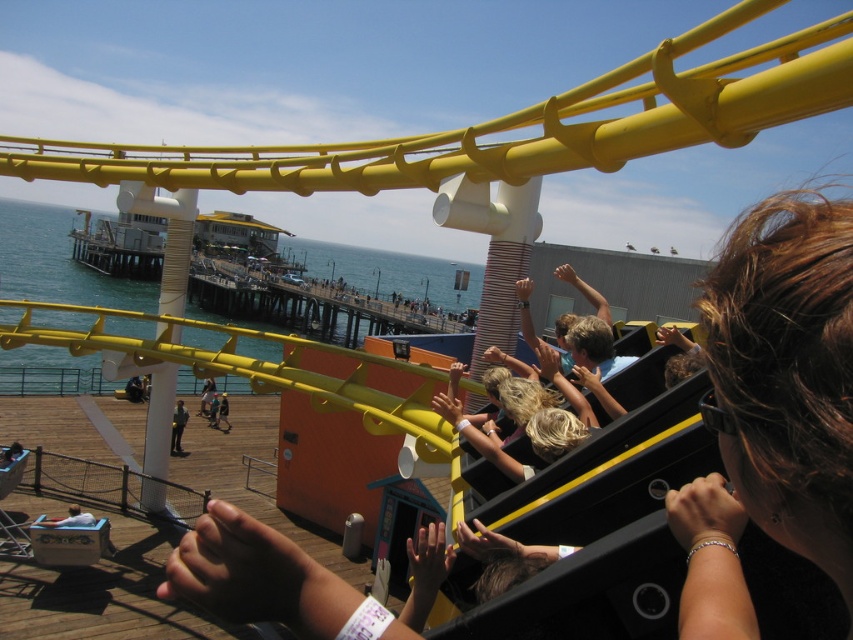
You are standing at the seaside amusement park and looking at the blue water at lower left and dark gray pants at lower left. Which one covers a larger area in the image?

The blue water at lower left is bigger than dark gray pants at lower left, so the blue water at lower left covers a larger area in the image.

Consider the image. You are a photographer standing at the seaside amusement park. You want to take a photo of the dark gray pants at lower left and the blue water at lower left. However, you notice that one of the objects is blocking the other. Which object is being blocked and by what?

The dark gray pants at lower left is behind blue water at lower left, so the blue water at lower left is blocking the dark gray pants at lower left.